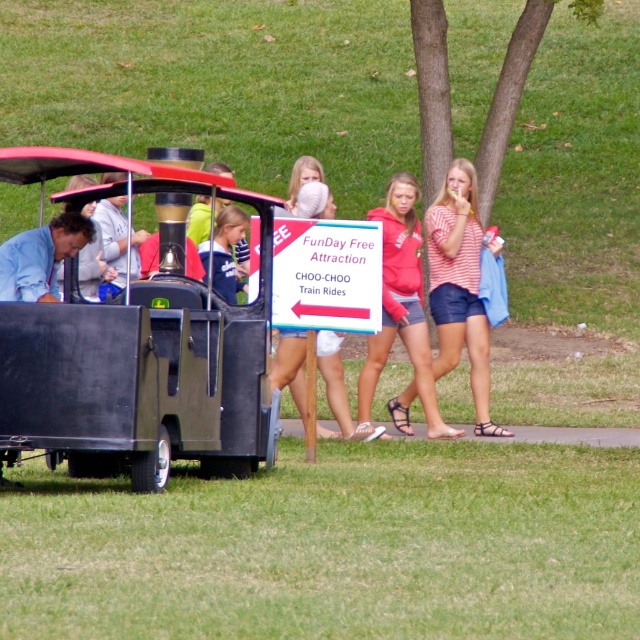
You are a parent at the park and see the matte black wagon at left and the matte red hoodie at center. Which item is located more to the left?

The matte black wagon at left is positioned on the left side of the matte red hoodie at center, so it is more to the left.

You are a visitor at the park and see the striped cotton shirt at center and the white paper sign at center. Which object is closer to you?

The striped cotton shirt at center is closer to you because the white paper sign at center is behind it.

You are a photographer at the park and want to capture both the striped cotton shirt at center and the white paper sign at center in your photo. Which object should you position closer to the left side of your camera frame?

You should position the white paper sign at center on the left side of your frame because the striped cotton shirt at center is to the right of it.